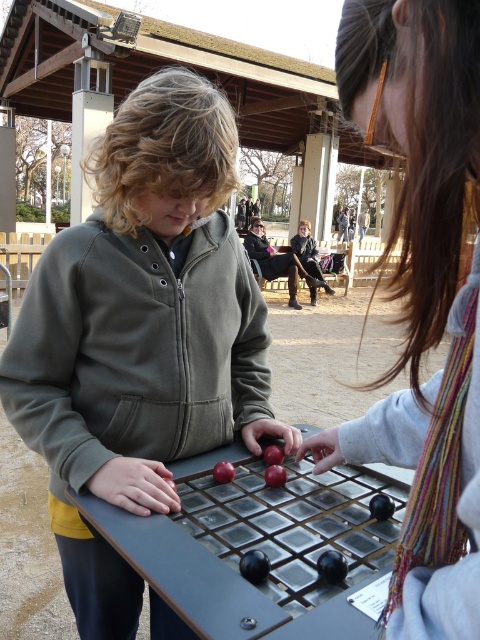
Question: Can you confirm if matte green jacket at center is bigger than black leather jacket at center?

Choices:
 (A) no
 (B) yes

Answer: (A)

Question: Is multicolored scarf at center smaller than black leather jacket at center?

Choices:
 (A) no
 (B) yes

Answer: (B)

Question: Which is farther from the shiny black board game at center?

Choices:
 (A) black leather jacket at center
 (B) matte green jacket at center

Answer: (A)

Question: Among these points, which one is farthest from the camera?

Choices:
 (A) (262, 243)
 (B) (407, 86)
 (C) (211, 493)

Answer: (A)

Question: Does multicolored scarf at center appear under black leather jacket at center?

Choices:
 (A) yes
 (B) no

Answer: (A)

Question: Which is farther from the multicolored scarf at center?

Choices:
 (A) shiny black board game at center
 (B) matte green jacket at center

Answer: (B)